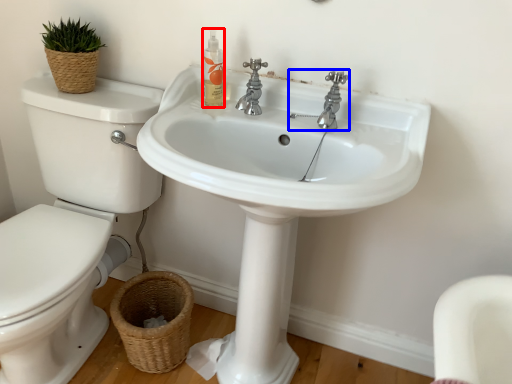
Question: Which object is closer to the camera taking this photo, cleaning product (highlighted by a red box) or tap (highlighted by a blue box)?

Choices:
 (A) cleaning product
 (B) tap

Answer: (B)